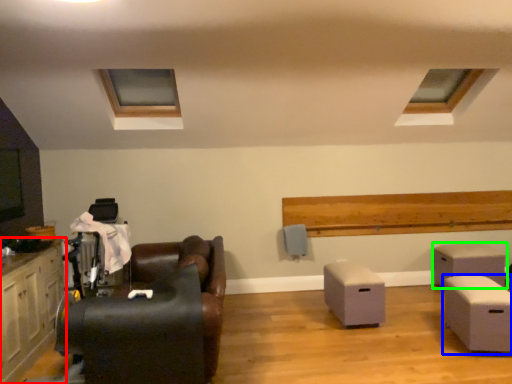
Question: Considering the real-world distances, which object is closest to cabinetry (highlighted by a red box)? table (highlighted by a blue box) or table (highlighted by a green box).

Choices:
 (A) table
 (B) table

Answer: (A)